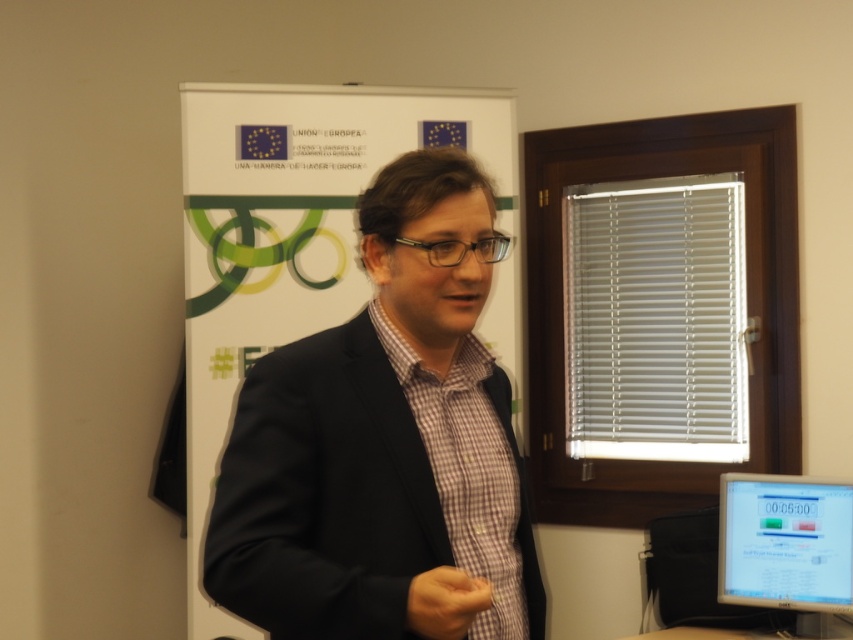
Question: Can you confirm if white paperboard at center is thinner than matte black monitor at lower right?

Choices:
 (A) yes
 (B) no

Answer: (B)

Question: Which object is positioned farthest from the white paperboard at center?

Choices:
 (A) brown leather hand at center
 (B) matte black monitor at lower right

Answer: (A)

Question: Which object appears closest to the camera in this image?

Choices:
 (A) white paperboard at center
 (B) brown leather hand at center
 (C) matte black monitor at lower right

Answer: (B)

Question: Is white paperboard at center to the right of matte black monitor at lower right from the viewer's perspective?

Choices:
 (A) yes
 (B) no

Answer: (B)

Question: Which object appears closest to the camera in this image?

Choices:
 (A) white paperboard at center
 (B) brown leather hand at center

Answer: (B)

Question: Does white paperboard at center appear over brown leather hand at center?

Choices:
 (A) no
 (B) yes

Answer: (B)